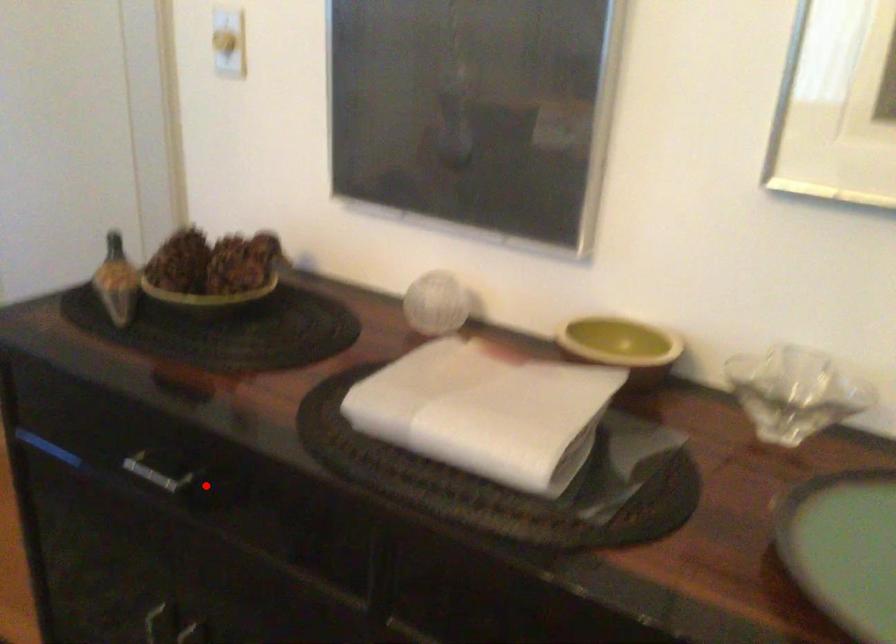
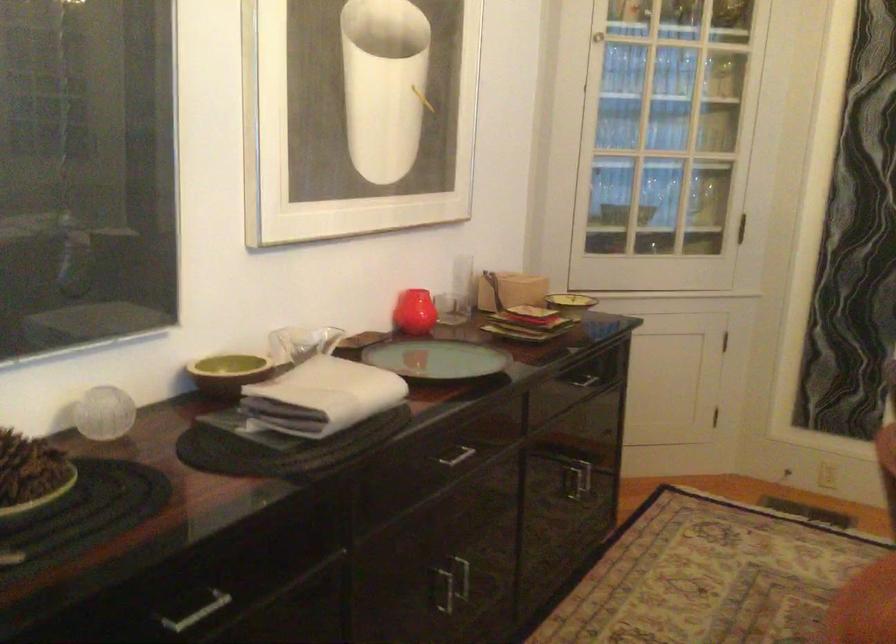
The point at the highlighted location is marked in the first image. Where is the corresponding point in the second image?

(194, 609)